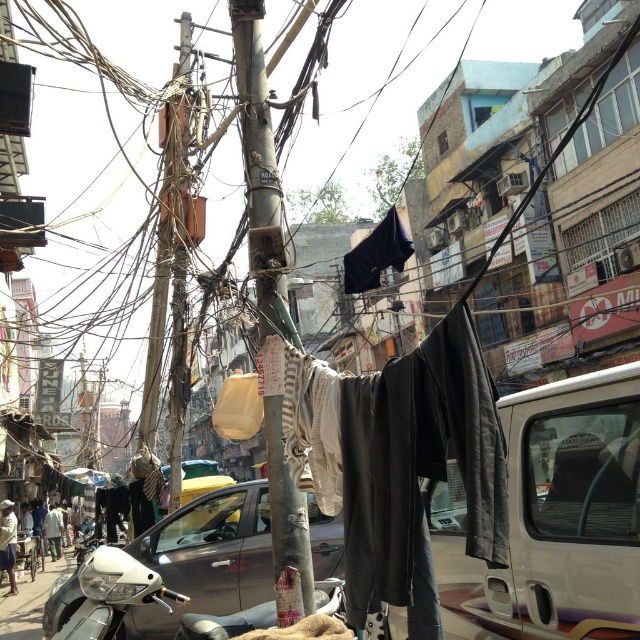
Does metallic gray car at center have a lesser width compared to dark blue jeans at lower left?

No, metallic gray car at center is not thinner than dark blue jeans at lower left.

Locate an element on the screen. metallic gray car at center is located at coordinates (205, 557).

Which is behind, point (221, 532) or point (54, 532)?

Point (54, 532)

Image resolution: width=640 pixels, height=640 pixels. What are the coordinates of `metallic gray car at center` in the screenshot? It's located at (205, 557).

What do you see at coordinates (8, 541) in the screenshot? I see `light brown fabric at lower left` at bounding box center [8, 541].

Is light brown fabric at lower left closer to the viewer compared to dark blue jeans at lower left?

Yes, light brown fabric at lower left is in front of dark blue jeans at lower left.

Find the location of a particular element. This screenshot has width=640, height=640. light brown fabric at lower left is located at coordinates (8, 541).

Between point (276, 296) and point (48, 512), which one is positioned behind?

The point (48, 512) is more distant.

Does rusty metal pole at center have a greater width compared to dark blue jeans at lower left?

In fact, rusty metal pole at center might be narrower than dark blue jeans at lower left.

Does point (298, 560) lie behind point (58, 554)?

No.

The image size is (640, 640). Find the location of `rusty metal pole at center`. rusty metal pole at center is located at coordinates (259, 164).